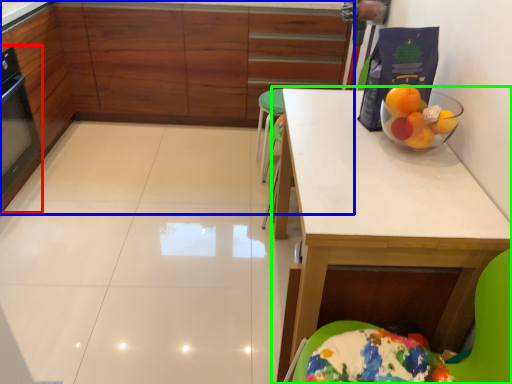
Question: Which is farther away from appliance (highlighted by a red box)? cabinetry (highlighted by a blue box) or table (highlighted by a green box)?

Choices:
 (A) cabinetry
 (B) table

Answer: (B)